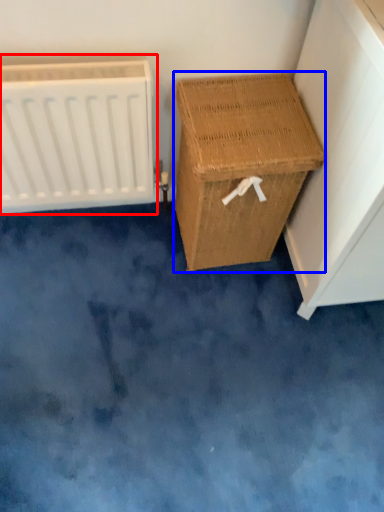
Question: Which object appears farthest to the camera in this image, radiator (highlighted by a red box) or furniture (highlighted by a blue box)?

Choices:
 (A) radiator
 (B) furniture

Answer: (B)